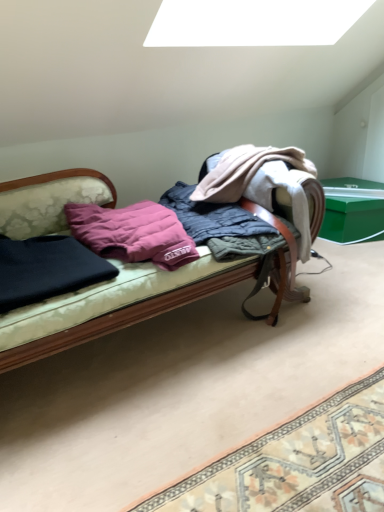
This screenshot has width=384, height=512. Describe the element at coordinates (352, 219) in the screenshot. I see `green plastic box at right` at that location.

Describe the element at coordinates (297, 463) in the screenshot. This screenshot has width=384, height=512. I see `patterned fabric mat at lower right` at that location.

Where is `quilted fabric blanket at center, arranged as the first clothing when viewed from the right`? This screenshot has height=512, width=384. quilted fabric blanket at center, arranged as the first clothing when viewed from the right is located at coordinates (266, 184).

The image size is (384, 512). I want to click on dark blue fabric at left, arranged as the 1th clothing when viewed from the left, so click(x=47, y=269).

Locate an element on the screen. This screenshot has height=512, width=384. green plastic box at right is located at coordinates (352, 219).

Between dark blue fabric at left, positioned as the second clothing in right-to-left order, and quilted fabric blanket at center, the second clothing positioned from the left, which one is positioned in front?

Positioned in front is dark blue fabric at left, positioned as the second clothing in right-to-left order.

How far apart are dark blue fabric at left, positioned as the second clothing in right-to-left order, and quilted fabric blanket at center, the second clothing positioned from the left?

A distance of 30.55 inches exists between dark blue fabric at left, positioned as the second clothing in right-to-left order, and quilted fabric blanket at center, the second clothing positioned from the left.

Is point (65, 247) closer to camera compared to point (304, 229)?

Yes.

Which is correct: dark blue fabric at left, arranged as the 1th clothing when viewed from the left, is inside quilted fabric blanket at center, the second clothing positioned from the left, or outside of it?

dark blue fabric at left, arranged as the 1th clothing when viewed from the left, exists outside the volume of quilted fabric blanket at center, the second clothing positioned from the left.

Considering the positions of objects dark blue fabric at left, positioned as the second clothing in right-to-left order, and green plastic box at right in the image provided, who is more to the left, dark blue fabric at left, positioned as the second clothing in right-to-left order, or green plastic box at right?

From the viewer's perspective, dark blue fabric at left, positioned as the second clothing in right-to-left order, appears more on the left side.

Consider the image. Which is closer, (x=40, y=283) or (x=348, y=199)?

Positioned in front is point (x=40, y=283).

Considering the sizes of dark blue fabric at left, positioned as the second clothing in right-to-left order, and green plastic box at right in the image, is dark blue fabric at left, positioned as the second clothing in right-to-left order, wider or thinner than green plastic box at right?

Considering their sizes, dark blue fabric at left, positioned as the second clothing in right-to-left order, looks slimmer than green plastic box at right.

Is dark blue fabric at left, positioned as the second clothing in right-to-left order, taller or shorter than green plastic box at right?

In the image, dark blue fabric at left, positioned as the second clothing in right-to-left order, appears to be shorter than green plastic box at right.

Does purple down pillow at center contain green plastic box at right?

Actually, green plastic box at right is outside purple down pillow at center.

This screenshot has width=384, height=512. In order to click on pillow above the green plastic box at right (from a real-world perspective) in this screenshot , I will do `click(133, 233)`.

Who is taller, purple down pillow at center or green plastic box at right?

green plastic box at right.

From the image's perspective, would you say purple down pillow at center is positioned over green plastic box at right?

No.

Can you tell me how much velvet-like fabric couch at center and quilted fabric blanket at center, the second clothing positioned from the left, differ in facing direction?

The angle between the facing direction of velvet-like fabric couch at center and the facing direction of quilted fabric blanket at center, the second clothing positioned from the left, is 0.000913 degrees.

Where is `clothing that is the 2nd one when counting backward from the velvet-like fabric couch at center`? The width and height of the screenshot is (384, 512). clothing that is the 2nd one when counting backward from the velvet-like fabric couch at center is located at coordinates (266, 184).

Is quilted fabric blanket at center, the second clothing positioned from the left, at the back of velvet-like fabric couch at center?

That's not correct — velvet-like fabric couch at center is not looking away from quilted fabric blanket at center, the second clothing positioned from the left.

Is velvet-like fabric couch at center taller than quilted fabric blanket at center, arranged as the first clothing when viewed from the right?

Yes, velvet-like fabric couch at center is taller than quilted fabric blanket at center, arranged as the first clothing when viewed from the right.

Can you tell me how much velvet-like fabric couch at center and green plastic box at right differ in facing direction?

The angle between the facing direction of velvet-like fabric couch at center and the facing direction of green plastic box at right is 3.55 degrees.

Relative to green plastic box at right, is velvet-like fabric couch at center in front or behind?

Visually, velvet-like fabric couch at center is located in front of green plastic box at right.

Is velvet-like fabric couch at center surrounding green plastic box at right?

Definitely not — green plastic box at right is not inside velvet-like fabric couch at center.

Who is taller, velvet-like fabric couch at center or green plastic box at right?

velvet-like fabric couch at center.

Considering the relative sizes of purple down pillow at center and patterned fabric mat at lower right in the image provided, is purple down pillow at center taller than patterned fabric mat at lower right?

Correct, purple down pillow at center is much taller as patterned fabric mat at lower right.

Is purple down pillow at center closer to the viewer compared to patterned fabric mat at lower right?

No.

Which is behind, point (157, 210) or point (380, 429)?

The point (157, 210) is farther from the camera.

How far apart are purple down pillow at center and patterned fabric mat at lower right?

purple down pillow at center and patterned fabric mat at lower right are 79.79 centimeters apart from each other.

Is purple down pillow at center turned away from dark blue fabric at left, positioned as the second clothing in right-to-left order?

No, purple down pillow at center's orientation is not away from dark blue fabric at left, positioned as the second clothing in right-to-left order.

Considering the sizes of objects purple down pillow at center and dark blue fabric at left, positioned as the second clothing in right-to-left order, in the image provided, who is taller, purple down pillow at center or dark blue fabric at left, positioned as the second clothing in right-to-left order,?

purple down pillow at center is taller.

Is point (121, 259) positioned in front of point (114, 267)?

No, (121, 259) is behind (114, 267).

Is purple down pillow at center positioned far away from dark blue fabric at left, arranged as the 1th clothing when viewed from the left?

purple down pillow at center is actually quite close to dark blue fabric at left, arranged as the 1th clothing when viewed from the left.

Where is `clothing located on the left of quilted fabric blanket at center, arranged as the first clothing when viewed from the right`? This screenshot has height=512, width=384. clothing located on the left of quilted fabric blanket at center, arranged as the first clothing when viewed from the right is located at coordinates (47, 269).

At what (x,y) coordinates should I click in order to perform the action: click on table on the right of dark blue fabric at left, arranged as the 1th clothing when viewed from the left. Please return your answer as a coordinate pair (x, y). This screenshot has height=512, width=384. Looking at the image, I should click on (352, 219).

Based on their spatial positions, is quilted fabric blanket at center, arranged as the first clothing when viewed from the right, or dark blue fabric at left, arranged as the 1th clothing when viewed from the left, further from velvet-like fabric couch at center?

quilted fabric blanket at center, arranged as the first clothing when viewed from the right, is further to velvet-like fabric couch at center.

Considering their positions, is purple down pillow at center positioned further to quilted fabric blanket at center, the second clothing positioned from the left, than green plastic box at right?

green plastic box at right.

Based on their spatial positions, is quilted fabric blanket at center, the second clothing positioned from the left, or dark blue fabric at left, positioned as the second clothing in right-to-left order, closer to purple down pillow at center?

Among the two, dark blue fabric at left, positioned as the second clothing in right-to-left order, is located nearer to purple down pillow at center.

When comparing their distances from patterned fabric mat at lower right, does quilted fabric blanket at center, the second clothing positioned from the left, or green plastic box at right seem closer?

quilted fabric blanket at center, the second clothing positioned from the left.

When comparing their distances from quilted fabric blanket at center, the second clothing positioned from the left, does velvet-like fabric couch at center or patterned fabric mat at lower right seem closer?

The object closer to quilted fabric blanket at center, the second clothing positioned from the left, is velvet-like fabric couch at center.

Looking at this image, estimate the real-world distances between objects in this image. Which object is further from patterned fabric mat at lower right, purple down pillow at center or dark blue fabric at left, positioned as the second clothing in right-to-left order?

The object further to patterned fabric mat at lower right is purple down pillow at center.

Considering their positions, is green plastic box at right positioned further to quilted fabric blanket at center, arranged as the first clothing when viewed from the right, than purple down pillow at center?

green plastic box at right.

From the image, which object appears to be nearer to dark blue fabric at left, arranged as the 1th clothing when viewed from the left, velvet-like fabric couch at center or green plastic box at right?

Based on the image, velvet-like fabric couch at center appears to be nearer to dark blue fabric at left, arranged as the 1th clothing when viewed from the left.

Where is `clothing between dark blue fabric at left, arranged as the 1th clothing when viewed from the left, and green plastic box at right, in the horizontal direction`? clothing between dark blue fabric at left, arranged as the 1th clothing when viewed from the left, and green plastic box at right, in the horizontal direction is located at coordinates (266, 184).

Where is `studio couch between dark blue fabric at left, positioned as the second clothing in right-to-left order, and green plastic box at right`? This screenshot has height=512, width=384. studio couch between dark blue fabric at left, positioned as the second clothing in right-to-left order, and green plastic box at right is located at coordinates (112, 306).

At what (x,y) coordinates should I click in order to perform the action: click on pillow between quilted fabric blanket at center, arranged as the first clothing when viewed from the right, and patterned fabric mat at lower right in the up-down direction. Please return your answer as a coordinate pair (x, y). This screenshot has width=384, height=512. Looking at the image, I should click on (133, 233).

At what (x,y) coordinates should I click in order to perform the action: click on pillow between dark blue fabric at left, positioned as the second clothing in right-to-left order, and patterned fabric mat at lower right, in the horizontal direction. Please return your answer as a coordinate pair (x, y). Image resolution: width=384 pixels, height=512 pixels. Looking at the image, I should click on (133, 233).